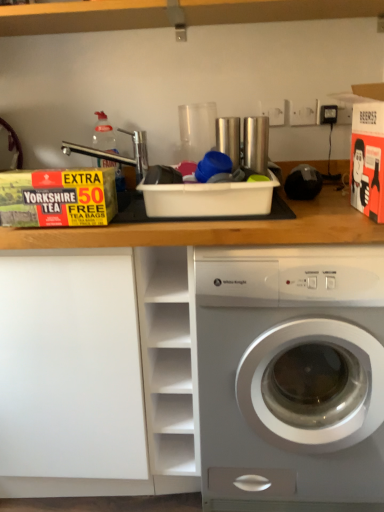
Question: From the image's perspective, is white matte box at left beneath white glossy washing machine at center?

Choices:
 (A) no
 (B) yes

Answer: (B)

Question: Does white matte box at left have a greater width compared to white glossy washing machine at center?

Choices:
 (A) no
 (B) yes

Answer: (A)

Question: Is white glossy washing machine at center inside white matte box at left?

Choices:
 (A) yes
 (B) no

Answer: (B)

Question: Would you say white matte box at left is outside white glossy washing machine at center?

Choices:
 (A) no
 (B) yes

Answer: (B)

Question: Is white matte box at left turned away from white glossy washing machine at center?

Choices:
 (A) yes
 (B) no

Answer: (B)

Question: Does white matte box at left have a lesser width compared to white glossy washing machine at center?

Choices:
 (A) no
 (B) yes

Answer: (B)

Question: Is white matte cabinet at center at the back of white glossy washing machine at center?

Choices:
 (A) yes
 (B) no

Answer: (B)

Question: Is white glossy washing machine at center outside of white matte cabinet at center?

Choices:
 (A) yes
 (B) no

Answer: (A)

Question: Is white glossy washing machine at center taller than white matte cabinet at center?

Choices:
 (A) no
 (B) yes

Answer: (B)

Question: Is white glossy washing machine at center further to camera compared to white matte cabinet at center?

Choices:
 (A) yes
 (B) no

Answer: (B)

Question: Would you consider white glossy washing machine at center to be distant from white matte cabinet at center?

Choices:
 (A) no
 (B) yes

Answer: (A)

Question: Is white glossy washing machine at center placed right next to white matte cabinet at center?

Choices:
 (A) yes
 (B) no

Answer: (B)

Question: Is white glossy washing machine at center completely or partially inside white matte cabinet at center?

Choices:
 (A) no
 (B) yes

Answer: (A)